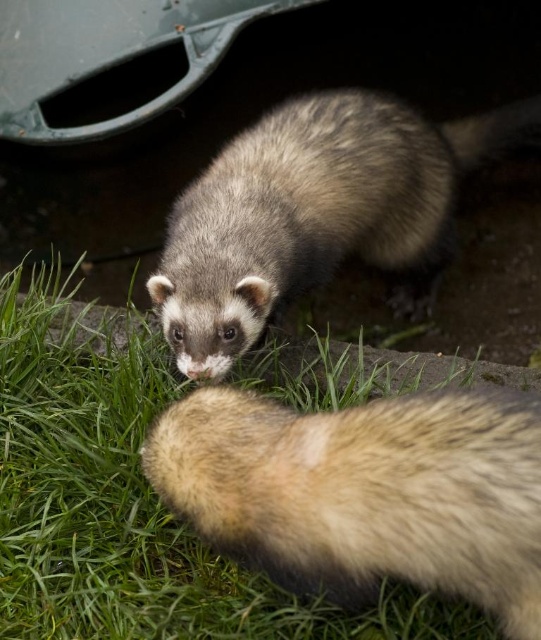
Can you confirm if green grass at lower left is wider than fuzzy brown ferret at center?

No.

Identify the location of green grass at lower left. This screenshot has height=640, width=541. (133, 506).

Who is more distant from viewer, (328,404) or (233,205)?

The point (233,205) is behind.

Where is `green grass at lower left`? green grass at lower left is located at coordinates (133, 506).

Is fuzzy fur at lower center above fuzzy brown ferret at center?

Incorrect, fuzzy fur at lower center is not positioned above fuzzy brown ferret at center.

At what (x,y) coordinates should I click in order to perform the action: click on fuzzy fur at lower center. Please return your answer as a coordinate pair (x, y). The image size is (541, 640). Looking at the image, I should click on (365, 492).

What do you see at coordinates (365, 492) in the screenshot? I see `fuzzy fur at lower center` at bounding box center [365, 492].

Where is `fuzzy fur at lower center`? fuzzy fur at lower center is located at coordinates (365, 492).

Does green grass at lower left have a lesser width compared to fuzzy fur at lower center?

In fact, green grass at lower left might be wider than fuzzy fur at lower center.

Is point (56, 624) positioned after point (459, 584)?

Yes, point (56, 624) is farther from viewer.

Is point (47, 499) behind point (209, 488)?

Yes, it is behind point (209, 488).

Find the location of a particular element. The image size is (541, 640). green grass at lower left is located at coordinates (133, 506).